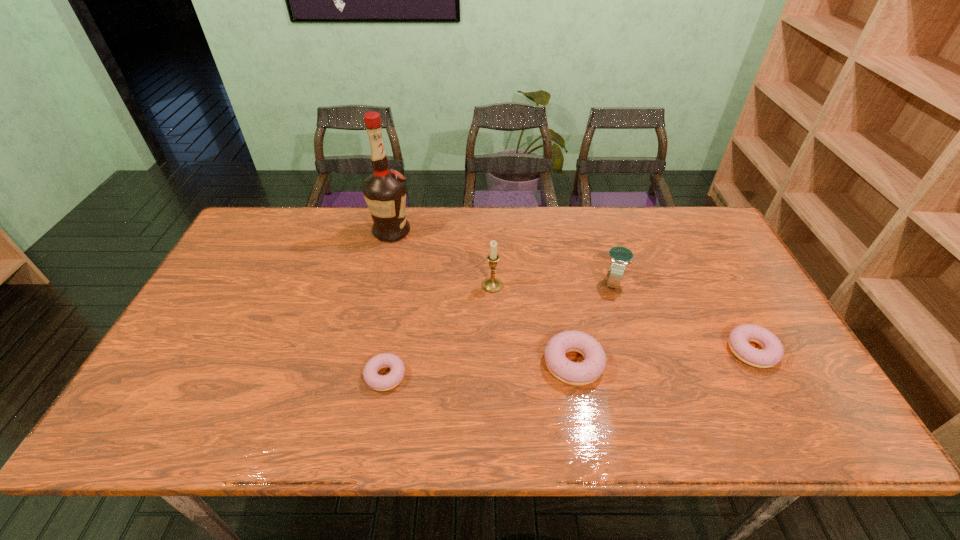
Find the location of a particular element. The width and height of the screenshot is (960, 540). object positioned at the near right corner is located at coordinates (772, 353).

This screenshot has height=540, width=960. In the image, there is a desktop. Identify the location of free space at the far edge. (648, 221).

The height and width of the screenshot is (540, 960). I want to click on vacant region at the near edge of the desktop, so click(x=461, y=394).

Where is `vacant space at the left edge`? Image resolution: width=960 pixels, height=540 pixels. vacant space at the left edge is located at coordinates (196, 310).

The height and width of the screenshot is (540, 960). In order to click on vacant space at the right edge of the desktop in this screenshot , I will do `click(721, 303)`.

Find the location of a particular element. The image size is (960, 540). vacant space at the far left corner of the desktop is located at coordinates (297, 215).

In the image, there is a desktop. At what (x,y) coordinates should I click in order to perform the action: click on free space at the near left corner. Please return your answer as a coordinate pair (x, y). This screenshot has width=960, height=540. Looking at the image, I should click on (207, 379).

At what (x,y) coordinates should I click in order to perform the action: click on blank space at the far right corner of the desktop. Please return your answer as a coordinate pair (x, y). The image size is (960, 540). Looking at the image, I should click on (706, 225).

At what (x,y) coordinates should I click in order to perform the action: click on unoccupied position between the liquor and the rightmost doughnut. Please return your answer as a coordinate pair (x, y). Looking at the image, I should click on (572, 291).

Find the location of a particular element. free space between the fifth shortest object and the leftmost doughnut is located at coordinates pos(439,330).